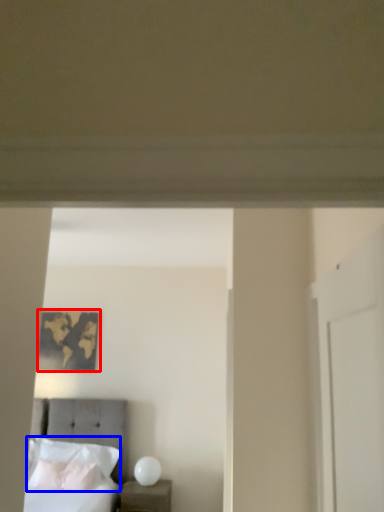
Question: Which object appears closest to the camera in this image, picture frame (highlighted by a red box) or pillow (highlighted by a blue box)?

Choices:
 (A) picture frame
 (B) pillow

Answer: (B)